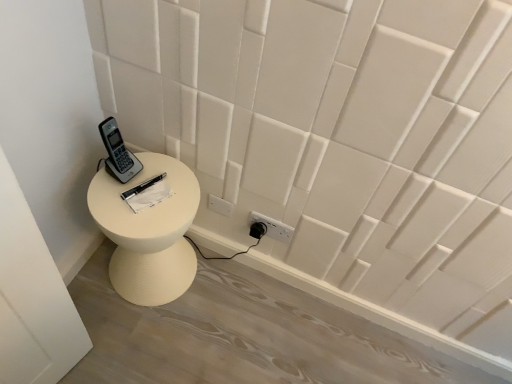
Question: Could you tell me if white matte side table at lower left is turned towards gray plastic phone at upper left?

Choices:
 (A) yes
 (B) no

Answer: (B)

Question: Considering the relative sizes of white matte side table at lower left and gray plastic phone at upper left in the image provided, is white matte side table at lower left smaller than gray plastic phone at upper left?

Choices:
 (A) no
 (B) yes

Answer: (A)

Question: From the image's perspective, is white matte side table at lower left located above gray plastic phone at upper left?

Choices:
 (A) no
 (B) yes

Answer: (A)

Question: From a real-world perspective, is white matte side table at lower left located beneath gray plastic phone at upper left?

Choices:
 (A) yes
 (B) no

Answer: (A)

Question: Can you confirm if white matte side table at lower left is shorter than gray plastic phone at upper left?

Choices:
 (A) no
 (B) yes

Answer: (A)

Question: From the image's perspective, is white paper at center positioned above or below gray plastic phone at upper left?

Choices:
 (A) below
 (B) above

Answer: (A)

Question: Is white paper at center situated inside gray plastic phone at upper left or outside?

Choices:
 (A) inside
 (B) outside

Answer: (B)

Question: Based on their positions, is white paper at center located to the left or right of gray plastic phone at upper left?

Choices:
 (A) right
 (B) left

Answer: (A)

Question: Considering the positions of white paper at center and gray plastic phone at upper left in the image, is white paper at center taller or shorter than gray plastic phone at upper left?

Choices:
 (A) short
 (B) tall

Answer: (A)

Question: Do you think gray plastic phone at upper left is within white matte side table at lower left, or outside of it?

Choices:
 (A) inside
 (B) outside

Answer: (B)

Question: Looking at the image, does gray plastic phone at upper left seem bigger or smaller compared to white matte side table at lower left?

Choices:
 (A) small
 (B) big

Answer: (A)

Question: Visually, is gray plastic phone at upper left positioned to the left or to the right of white matte side table at lower left?

Choices:
 (A) right
 (B) left

Answer: (B)

Question: Is point (128, 170) closer or farther from the camera than point (97, 201)?

Choices:
 (A) farther
 (B) closer

Answer: (A)

Question: Looking at their shapes, would you say white matte side table at lower left is wider or thinner than gray plastic phone at upper left?

Choices:
 (A) wide
 (B) thin

Answer: (A)

Question: Is point (172, 278) closer or farther from the camera than point (132, 170)?

Choices:
 (A) closer
 (B) farther

Answer: (B)